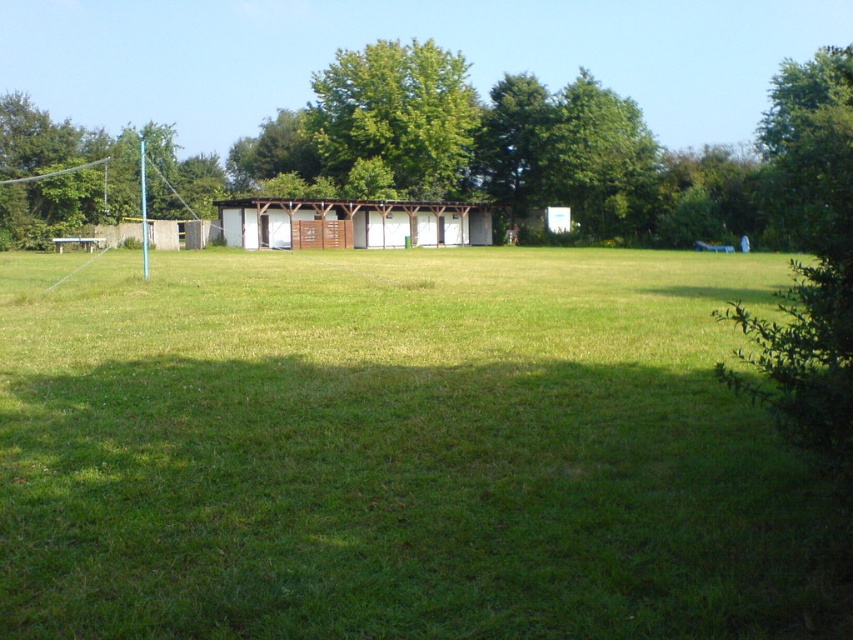
Does green leafy tree at center appear on the right side of wooden shed at center?

Incorrect, green leafy tree at center is not on the right side of wooden shed at center.

Identify the location of green leafy tree at center. The image size is (853, 640). (397, 115).

Is green leafy tree at center to the left of green leafy tree at left from the viewer's perspective?

Incorrect, green leafy tree at center is not on the left side of green leafy tree at left.

Who is lower down, green leafy tree at center or green leafy tree at left?

green leafy tree at left is lower down.

What do you see at coordinates (397, 115) in the screenshot? I see `green leafy tree at center` at bounding box center [397, 115].

Where is `green leafy tree at center`? The image size is (853, 640). green leafy tree at center is located at coordinates (397, 115).

Which is above, green grassy field at center or green leafy tree at left?

Positioned higher is green leafy tree at left.

Between point (709, 456) and point (157, 134), which one is positioned behind?

Positioned behind is point (157, 134).

Does point (712, 328) come closer to viewer compared to point (7, 145)?

Yes, it is in front of point (7, 145).

You are a GUI agent. You are given a task and a screenshot of the screen. Output one action in this format:
    pyautogui.click(x=<x>, y=<y>)
    Task: Click on the green grassy field at center
    Image resolution: width=853 pixels, height=640 pixels.
    Given the screenshot: What is the action you would take?
    pyautogui.click(x=396, y=451)